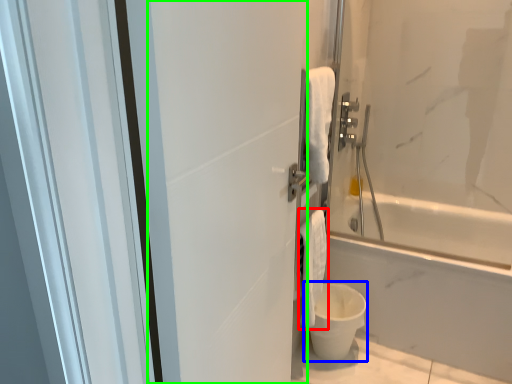
Question: Which is nearer to the bath towel (highlighted by a red box)? toilet bowl (highlighted by a blue box) or screen door (highlighted by a green box).

Choices:
 (A) toilet bowl
 (B) screen door

Answer: (A)